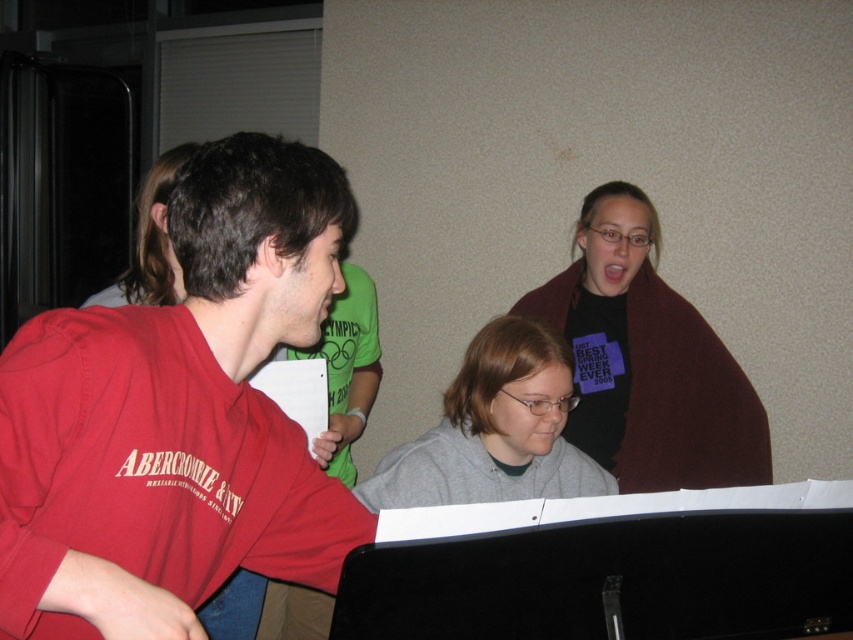
Question: Which object is farther from the camera taking this photo?

Choices:
 (A) matte red shirt at left
 (B) gray matte hoodie at center

Answer: (B)

Question: Where is matte red shirt at left located in relation to maroon fleece blanket at upper right in the image?

Choices:
 (A) below
 (B) above

Answer: (A)

Question: Which point is closer to the camera?

Choices:
 (A) gray matte hoodie at center
 (B) matte red shirt at left
 (C) maroon fleece blanket at upper right

Answer: (B)

Question: Is matte red shirt at left positioned behind maroon fleece blanket at upper right?

Choices:
 (A) yes
 (B) no

Answer: (B)

Question: Among these points, which one is nearest to the camera?

Choices:
 (A) (468, 428)
 (B) (260, 250)

Answer: (B)

Question: Is maroon fleece blanket at upper right to the right of gray matte hoodie at center from the viewer's perspective?

Choices:
 (A) yes
 (B) no

Answer: (A)